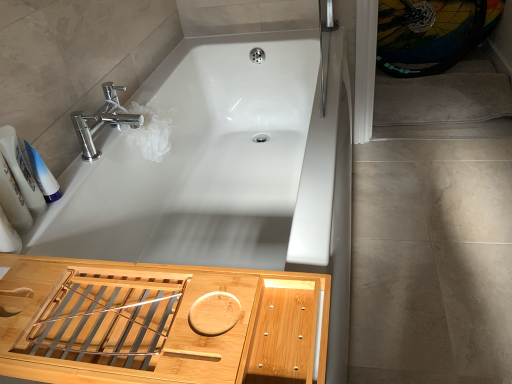
What do you see at coordinates (42, 175) in the screenshot? I see `white plastic tube at left, the second toiletry from the left` at bounding box center [42, 175].

The image size is (512, 384). Describe the element at coordinates (365, 63) in the screenshot. I see `gray carpet at right` at that location.

What is the approximate height of white glossy bathtub at center?

white glossy bathtub at center is 21.36 inches tall.

Measure the distance between beige tile floor at lower right and camera.

beige tile floor at lower right is 1.08 meters away from camera.

Describe the element at coordinates (432, 262) in the screenshot. The width and height of the screenshot is (512, 384). I see `beige tile floor at lower right` at that location.

Identify the location of white glossy bottles at left, the 1th toiletry positioned from the left. (21, 170).

Is beige tile floor at lower right oriented towards white plastic tube at left, the second toiletry from the left?

No, beige tile floor at lower right does not turn towards white plastic tube at left, the second toiletry from the left.

This screenshot has height=384, width=512. I want to click on concrete that appears below the white plastic tube at left, which is counted as the 1th toiletry, starting from the right (from the image's perspective), so click(x=432, y=262).

From the image's perspective, which is below, beige tile floor at lower right or white plastic tube at left, the second toiletry from the left?

beige tile floor at lower right, from the image's perspective.

Is beige tile floor at lower right positioned beyond the bounds of white plastic tube at left, which is counted as the 1th toiletry, starting from the right?

beige tile floor at lower right lies outside white plastic tube at left, which is counted as the 1th toiletry, starting from the right,'s area.

Can you confirm if chrome/metallic faucet at upper left is smaller than bamboo tray at lower left?

Yes.

How different are the orientations of chrome/metallic faucet at upper left and bamboo tray at lower left in degrees?

The facing directions of chrome/metallic faucet at upper left and bamboo tray at lower left are 90.5 degrees apart.

Relative to bamboo tray at lower left, is chrome/metallic faucet at upper left in front or behind?

Visually, chrome/metallic faucet at upper left is located behind bamboo tray at lower left.

Considering the relative sizes of chrome/metallic faucet at upper left and bamboo tray at lower left in the image provided, is chrome/metallic faucet at upper left shorter than bamboo tray at lower left?

No.

From the image's perspective, is multicolored rubber bicycle wheel at upper right above white glossy bathtub at center?

Yes.

Is multicolored rubber bicycle wheel at upper right positioned with its back to white glossy bathtub at center?

No, multicolored rubber bicycle wheel at upper right is not facing the opposite direction of white glossy bathtub at center.

Is multicolored rubber bicycle wheel at upper right touching white glossy bathtub at center?

multicolored rubber bicycle wheel at upper right and white glossy bathtub at center are not in contact.

Which is correct: multicolored rubber bicycle wheel at upper right is inside white glossy bathtub at center, or outside of it?

multicolored rubber bicycle wheel at upper right is located beyond the bounds of white glossy bathtub at center.

From a real-world perspective, is white plastic tube at left, which is counted as the 1th toiletry, starting from the right, positioned above or below gray carpet at right?

white plastic tube at left, which is counted as the 1th toiletry, starting from the right, is situated higher than gray carpet at right in the real world.

In the scene shown: From the image's perspective, who appears lower, white plastic tube at left, which is counted as the 1th toiletry, starting from the right, or gray carpet at right?

white plastic tube at left, which is counted as the 1th toiletry, starting from the right, appears lower in the image.

Considering the positions of points (30, 150) and (371, 16), is point (30, 150) closer to camera compared to point (371, 16)?

Yes, it is in front of point (371, 16).

Is white plastic tube at left, which is counted as the 1th toiletry, starting from the right, surrounding gray carpet at right?

No.

Is white plastic tube at left, which is counted as the 1th toiletry, starting from the right, further to camera compared to white glossy bottles at left, the second toiletry from the right?

Yes, it is.

Is white plastic tube at left, which is counted as the 1th toiletry, starting from the right, next to white glossy bottles at left, the 1th toiletry positioned from the left, and touching it?

Yes, white plastic tube at left, which is counted as the 1th toiletry, starting from the right, is beside white glossy bottles at left, the 1th toiletry positioned from the left.

Who is taller, white plastic tube at left, which is counted as the 1th toiletry, starting from the right, or white glossy bottles at left, the second toiletry from the right?

white glossy bottles at left, the second toiletry from the right.

Considering the sizes of objects white plastic tube at left, which is counted as the 1th toiletry, starting from the right, and white glossy bottles at left, the second toiletry from the right, in the image provided, who is bigger, white plastic tube at left, which is counted as the 1th toiletry, starting from the right, or white glossy bottles at left, the second toiletry from the right,?

white glossy bottles at left, the second toiletry from the right, is bigger.

Considering the relative positions of multicolored rubber bicycle wheel at upper right and chrome/metallic faucet at upper left in the image provided, is multicolored rubber bicycle wheel at upper right to the left of chrome/metallic faucet at upper left from the viewer's perspective?

In fact, multicolored rubber bicycle wheel at upper right is to the right of chrome/metallic faucet at upper left.

In terms of size, does multicolored rubber bicycle wheel at upper right appear bigger or smaller than chrome/metallic faucet at upper left?

In the image, multicolored rubber bicycle wheel at upper right appears to be larger than chrome/metallic faucet at upper left.

Which object is wider, multicolored rubber bicycle wheel at upper right or chrome/metallic faucet at upper left?

With larger width is chrome/metallic faucet at upper left.

This screenshot has width=512, height=384. Identify the location of bicycle wheel located on the right of chrome/metallic faucet at upper left. (426, 34).

How distant is chrome/metallic faucet at upper left from gray carpet at right?

89.98 centimeters.

Considering the positions of objects chrome/metallic faucet at upper left and gray carpet at right in the image provided, who is behind, chrome/metallic faucet at upper left or gray carpet at right?

gray carpet at right is more distant.

Would you consider chrome/metallic faucet at upper left to be distant from gray carpet at right?

No, chrome/metallic faucet at upper left is not far from gray carpet at right.

Identify the location of the 2nd toiletry positioned above the beige tile floor at lower right (from the image's perspective). This screenshot has height=384, width=512. (42, 175).

Find the location of a particular element. Image resolution: width=512 pixels, height=384 pixels. cabinetry beneath the chrome/metallic faucet at upper left (from a real-world perspective) is located at coordinates (157, 323).

Based on their spatial positions, is beige tile floor at lower right or bamboo tray at lower left further from multicolored rubber bicycle wheel at upper right?

bamboo tray at lower left.

Based on their spatial positions, is bamboo tray at lower left or beige tile floor at lower right further from white glossy bathtub at center?

Based on the image, bamboo tray at lower left appears to be further to white glossy bathtub at center.

Looking at the image, which one is located further to bamboo tray at lower left, chrome/metallic faucet at upper left or beige tile floor at lower right?

Based on the image, beige tile floor at lower right appears to be further to bamboo tray at lower left.

From the image, which object appears to be farther from white plastic tube at left, the second toiletry from the left, white glossy bathtub at center or chrome/metallic faucet at upper left?

Based on the image, white glossy bathtub at center appears to be further to white plastic tube at left, the second toiletry from the left.

Based on their spatial positions, is white glossy bottles at left, the second toiletry from the right, or white glossy bathtub at center closer to chrome/metallic faucet at upper left?

The object closer to chrome/metallic faucet at upper left is white glossy bottles at left, the second toiletry from the right.

From the image, which object appears to be farther from chrome/metallic faucet at upper left, white plastic tube at left, which is counted as the 1th toiletry, starting from the right, or beige tile floor at lower right?

Among the two, beige tile floor at lower right is located further to chrome/metallic faucet at upper left.

From the image, which object appears to be nearer to multicolored rubber bicycle wheel at upper right, bamboo tray at lower left or chrome/metallic faucet at upper left?

Among the two, chrome/metallic faucet at upper left is located nearer to multicolored rubber bicycle wheel at upper right.

Based on their spatial positions, is beige tile floor at lower right or multicolored rubber bicycle wheel at upper right closer to white glossy bathtub at center?

Among the two, beige tile floor at lower right is located nearer to white glossy bathtub at center.

Find the location of a particular element. The height and width of the screenshot is (384, 512). cabinetry between white glossy bottles at left, the 1th toiletry positioned from the left, and beige tile floor at lower right, in the horizontal direction is located at coordinates tap(157, 323).

Where is `concrete between white glossy bottles at left, the second toiletry from the right, and gray carpet at right`? The height and width of the screenshot is (384, 512). concrete between white glossy bottles at left, the second toiletry from the right, and gray carpet at right is located at coordinates (432, 262).

What are the coordinates of `screen door located between white plastic tube at left, which is counted as the 1th toiletry, starting from the right, and multicolored rubber bicycle wheel at upper right in the left-right direction` in the screenshot? It's located at [365, 63].

At what (x,y) coordinates should I click in order to perform the action: click on tap between white glossy bathtub at center and multicolored rubber bicycle wheel at upper right along the z-axis. Please return your answer as a coordinate pair (x, y). This screenshot has width=512, height=384. Looking at the image, I should click on point(102,120).